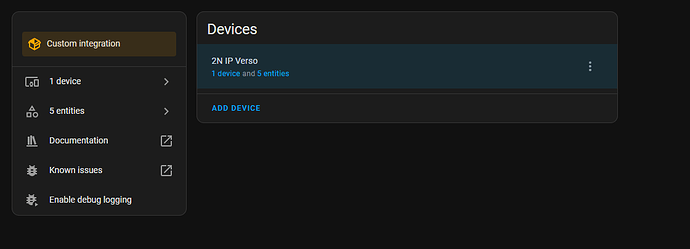
Identify the location of devices. This screenshot has width=690, height=249. (208, 28).